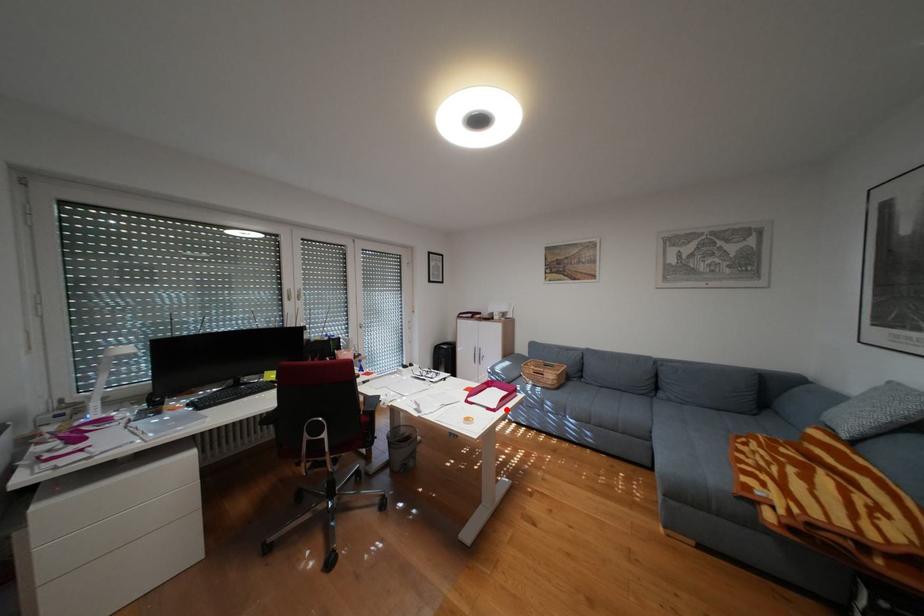
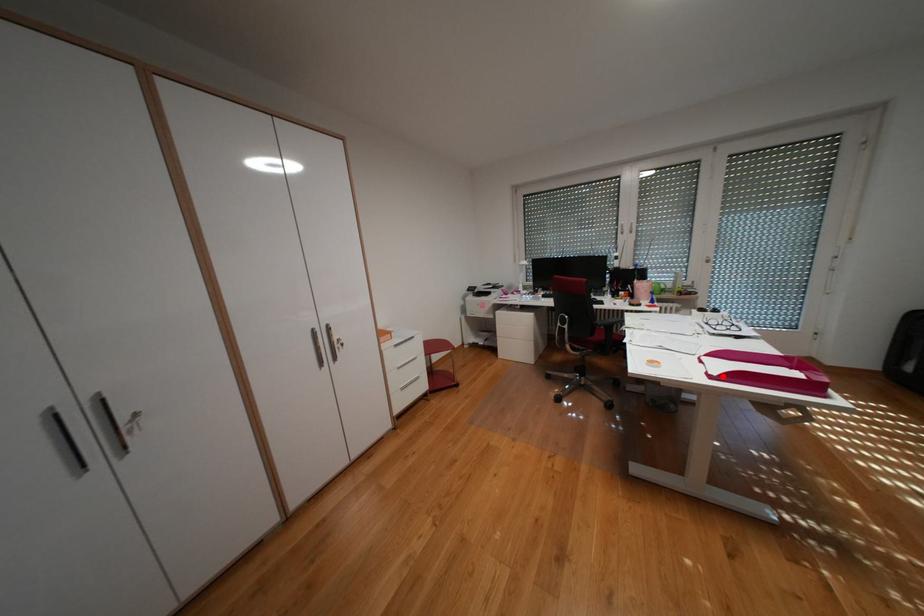
From the picture: I am providing you with two images of the same scene from different viewpoints. A red point is marked on the first image and another point is marked on the second image. Is the red point in image1 aligned with the point shown in image2?

Yes